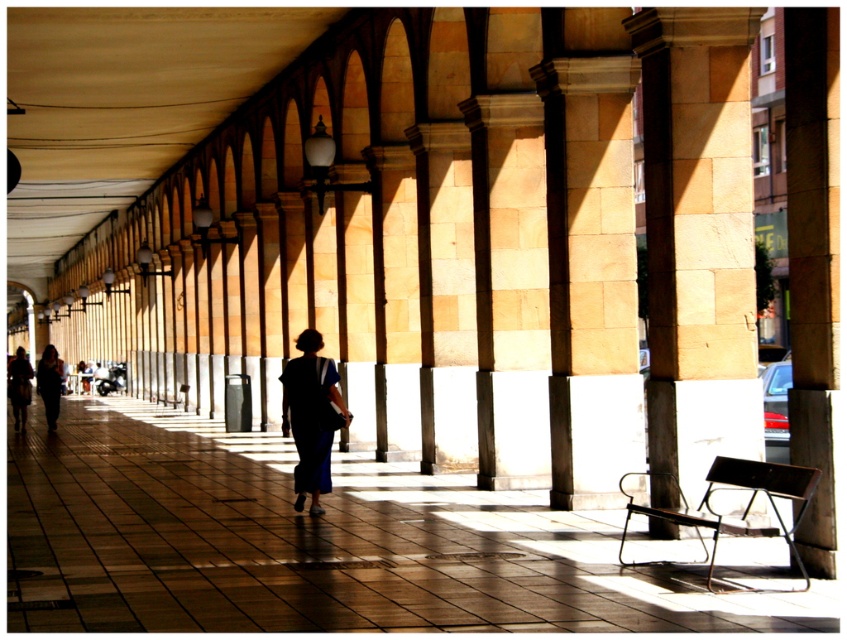
Does dark blue dress at center lie behind dark blue fabric at center?

→ No.

Can you confirm if dark blue dress at center is thinner than dark blue fabric at center?

No, dark blue dress at center is not thinner than dark blue fabric at center.

The image size is (847, 640). What do you see at coordinates (48, 384) in the screenshot?
I see `dark blue dress at center` at bounding box center [48, 384].

In order to click on dark blue dress at center in this screenshot , I will do `click(48, 384)`.

Can you confirm if brown tile corridor at center is smaller than beige stone pillar at center?

Incorrect, brown tile corridor at center is not smaller in size than beige stone pillar at center.

Describe the element at coordinates (319, 545) in the screenshot. The height and width of the screenshot is (640, 847). I see `brown tile corridor at center` at that location.

At what (x,y) coordinates should I click in order to perform the action: click on brown tile corridor at center. Please return your answer as a coordinate pair (x, y). Looking at the image, I should click on (319, 545).

Is beige stone pillar at center taller than dark blue dress at center?

No, beige stone pillar at center is not taller than dark blue dress at center.

Who is higher up, beige stone pillar at center or dark blue dress at center?

Positioned higher is beige stone pillar at center.

Is point (709, 65) less distant than point (54, 410)?

Yes, it is.

The height and width of the screenshot is (640, 847). In order to click on beige stone pillar at center in this screenshot , I will do `click(698, 236)`.